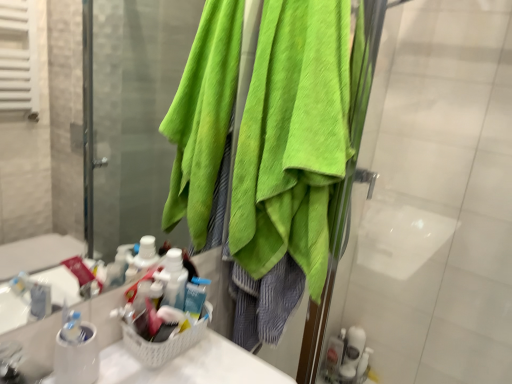
Question: Should I look upward or downward to see white glossy toothbrush at lower right, the second toiletry when ordered from left to right?

Choices:
 (A) down
 (B) up

Answer: (A)

Question: Considering the relative sizes of green towel at upper right and translucent plastic soap dispenser at lower right, the first toiletry viewed from the left, in the image provided, is green towel at upper right bigger than translucent plastic soap dispenser at lower right, the first toiletry viewed from the left,?

Choices:
 (A) no
 (B) yes

Answer: (B)

Question: From the image's perspective, is green towel at upper right located beneath translucent plastic soap dispenser at lower right, arranged as the 2th toiletry when viewed from the right?

Choices:
 (A) no
 (B) yes

Answer: (A)

Question: From a real-world perspective, is green towel at upper right physically above translucent plastic soap dispenser at lower right, arranged as the 2th toiletry when viewed from the right?

Choices:
 (A) yes
 (B) no

Answer: (A)

Question: Is translucent plastic soap dispenser at lower right, arranged as the 2th toiletry when viewed from the right, at the back of green towel at upper right?

Choices:
 (A) yes
 (B) no

Answer: (B)

Question: From the image's perspective, is green towel at upper right on top of translucent plastic soap dispenser at lower right, arranged as the 2th toiletry when viewed from the right?

Choices:
 (A) no
 (B) yes

Answer: (B)

Question: Does green towel at upper right have a greater width compared to translucent plastic soap dispenser at lower right, the first toiletry viewed from the left?

Choices:
 (A) yes
 (B) no

Answer: (A)

Question: From a real-world perspective, does white glossy toothbrush at lower right, the second toiletry when ordered from left to right, sit lower than translucent plastic soap dispenser at lower right, the first toiletry viewed from the left?

Choices:
 (A) yes
 (B) no

Answer: (B)

Question: Is white glossy toothbrush at lower right, which appears as the first toiletry when viewed from the right, thinner than translucent plastic soap dispenser at lower right, the first toiletry viewed from the left?

Choices:
 (A) yes
 (B) no

Answer: (B)

Question: Is white glossy toothbrush at lower right, the second toiletry when ordered from left to right, to the right of translucent plastic soap dispenser at lower right, the first toiletry viewed from the left, from the viewer's perspective?

Choices:
 (A) no
 (B) yes

Answer: (B)

Question: From a real-world perspective, does white glossy toothbrush at lower right, which appears as the first toiletry when viewed from the right, stand above translucent plastic soap dispenser at lower right, arranged as the 2th toiletry when viewed from the right?

Choices:
 (A) yes
 (B) no

Answer: (A)

Question: Is white glossy toothbrush at lower right, the second toiletry when ordered from left to right, aimed at translucent plastic soap dispenser at lower right, arranged as the 2th toiletry when viewed from the right?

Choices:
 (A) no
 (B) yes

Answer: (A)

Question: Considering the relative sizes of white glossy toothbrush at lower right, the second toiletry when ordered from left to right, and translucent plastic soap dispenser at lower right, arranged as the 2th toiletry when viewed from the right, in the image provided, is white glossy toothbrush at lower right, the second toiletry when ordered from left to right, taller than translucent plastic soap dispenser at lower right, arranged as the 2th toiletry when viewed from the right,?

Choices:
 (A) yes
 (B) no

Answer: (A)

Question: From a real-world perspective, does translucent plastic soap dispenser at lower right, the first toiletry viewed from the left, stand above white glossy toothbrush at lower right, which appears as the first toiletry when viewed from the right?

Choices:
 (A) yes
 (B) no

Answer: (B)